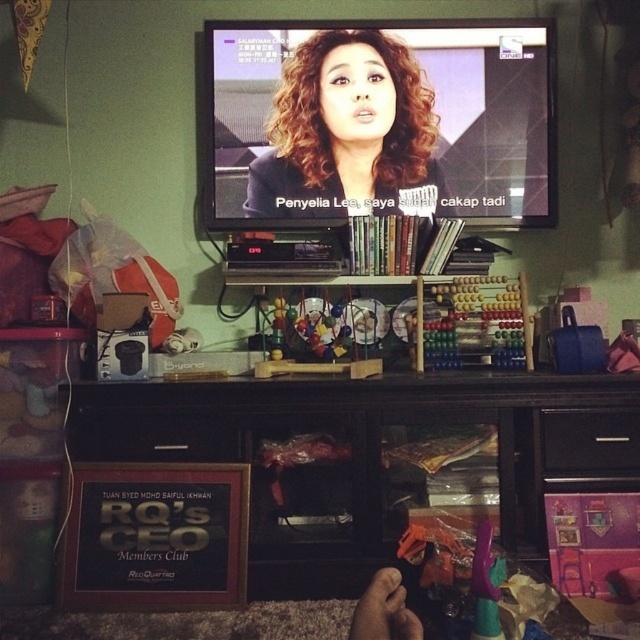
You are arranging a small plant on the black wood dresser at lower center. The plant pot is 10 cm wide. Can the plant fit on the dresser if the matte black hair at center is 8 cm wide?

The black wood dresser at lower center is wider than the matte black hair at center, which is 8 cm wide. Since the dresser is wider, the plant pot measuring 10 cm can fit on the black wood dresser at lower center.

You are standing in the living room and want to touch both the matte black hair at center and the wooden abacus at center. Which object will you reach first?

The matte black hair at center is closer to you than the wooden abacus at center, so you will reach it first.